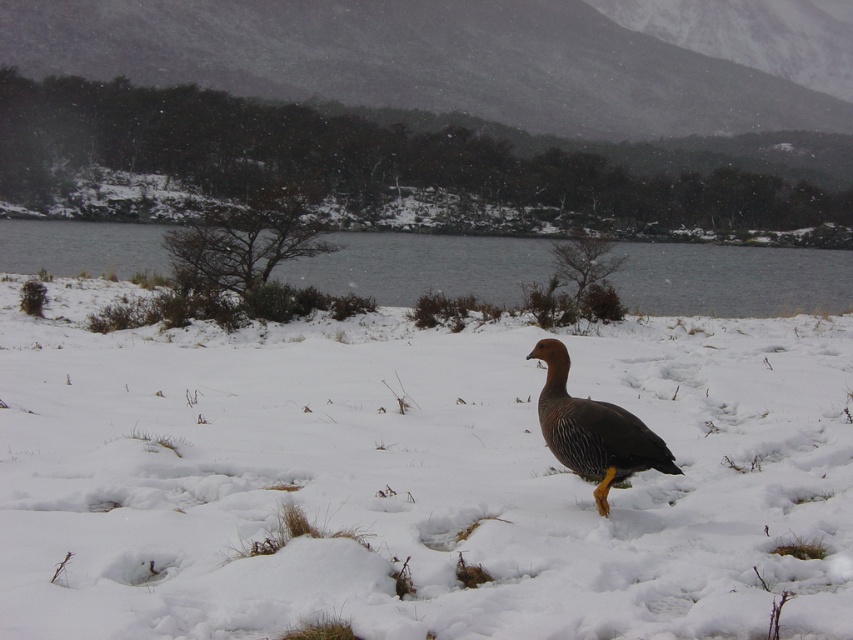
Question: Estimate the real-world distances between objects in this image. Which object is farther from the brown feathered duck at center?

Choices:
 (A) gray water at center
 (B) white fluffy snow at center

Answer: (A)

Question: Which point is closer to the camera?

Choices:
 (A) (605, 461)
 (B) (715, 273)

Answer: (A)

Question: Can you confirm if gray water at center is positioned to the right of brown feathered duck at center?

Choices:
 (A) no
 (B) yes

Answer: (A)

Question: Can you confirm if white fluffy snow at center is thinner than gray water at center?

Choices:
 (A) no
 (B) yes

Answer: (B)

Question: Can you confirm if white fluffy snow at center is thinner than gray water at center?

Choices:
 (A) yes
 (B) no

Answer: (A)

Question: Which of the following is the closest to the observer?

Choices:
 (A) (569, 404)
 (B) (321, 275)

Answer: (A)